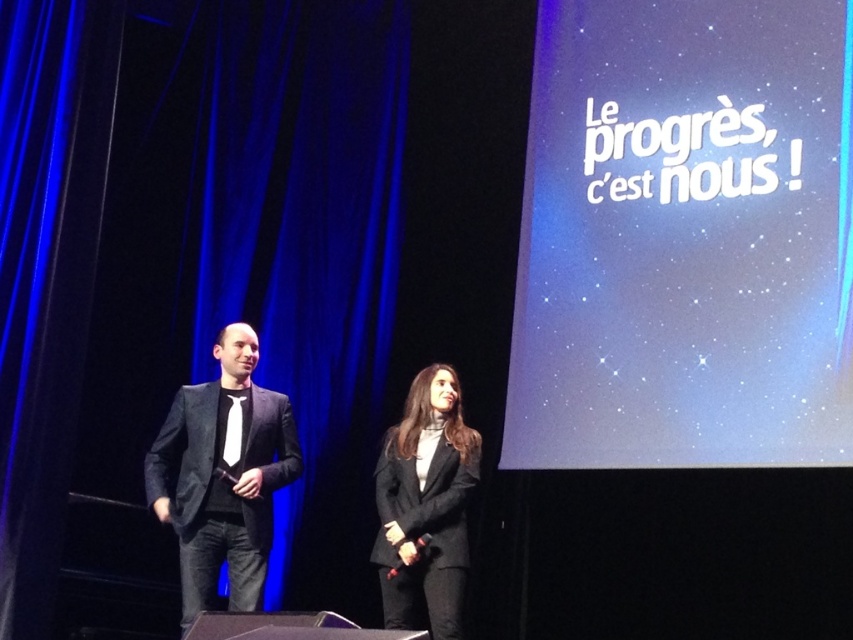
Question: Which point appears farthest from the camera in this image?

Choices:
 (A) pos(90,323)
 (B) pos(166,428)

Answer: (A)

Question: From the image, what is the correct spatial relationship of blue velvet curtain at left in relation to matte black suit at left?

Choices:
 (A) left
 (B) right

Answer: (A)

Question: Is matte black suit at left closer to camera compared to black matte blazer at center?

Choices:
 (A) yes
 (B) no

Answer: (A)

Question: Among these points, which one is nearest to the camera?

Choices:
 (A) (289, 483)
 (B) (589, 410)
 (C) (42, 288)

Answer: (B)

Question: Can you confirm if blue velvet curtain at left is positioned below matte white text at upper right?

Choices:
 (A) yes
 (B) no

Answer: (A)

Question: Which point is farther from the camera taking this photo?

Choices:
 (A) (467, 433)
 (B) (213, 547)
 (C) (604, 157)
 (D) (347, 316)

Answer: (D)